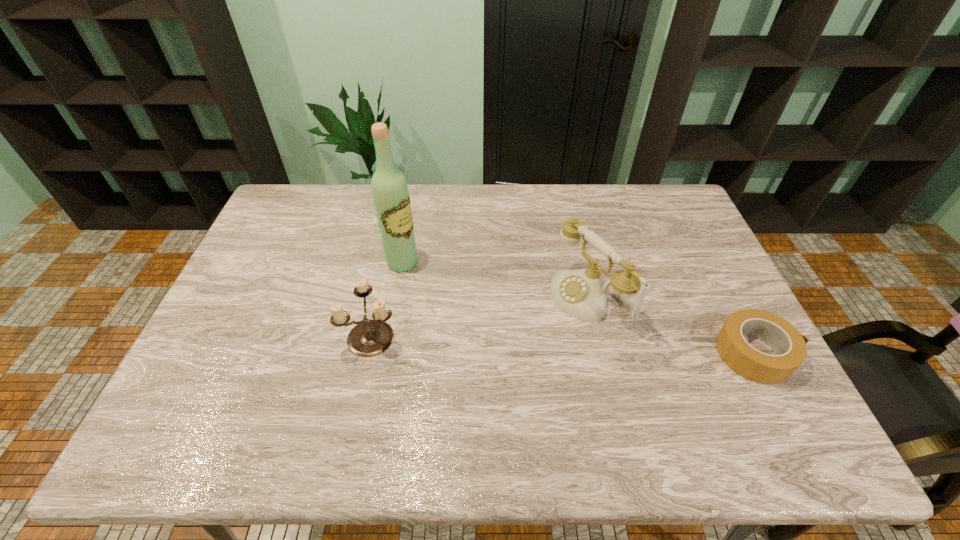
This screenshot has width=960, height=540. Identify the location of candle holder. [x=369, y=338].

The image size is (960, 540). In order to click on the rightmost object in this screenshot , I will do `click(789, 345)`.

Where is `the shortest object`? Image resolution: width=960 pixels, height=540 pixels. the shortest object is located at coordinates (789, 345).

Locate an element on the screen. the second object from right to left is located at coordinates (582, 294).

I want to click on wine bottle, so click(390, 192).

Identify the location of vacant space situated on the back of the candle holder. coord(391,247).

The height and width of the screenshot is (540, 960). I want to click on vacant space situated 0.130m on the dial of the second object from right to left, so click(522, 336).

Where is `vacant space located on the dial of the second object from right to left`? vacant space located on the dial of the second object from right to left is located at coordinates (444, 377).

Image resolution: width=960 pixels, height=540 pixels. I want to click on vacant region located 0.200m on the dial of the second object from right to left, so click(501, 347).

Find the location of a particular element. vacant space located 0.200m on the front-facing side of the tallest object is located at coordinates (464, 300).